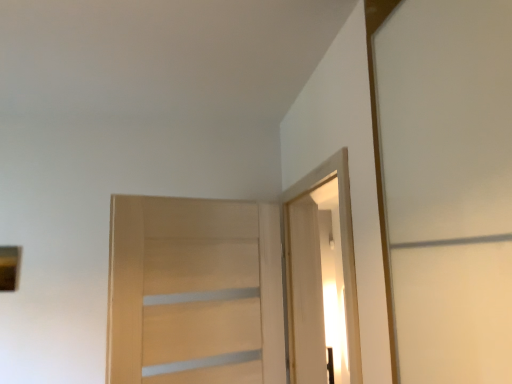
Question: Can light wood door at center, which is the 2th door from right to left, be found inside white glossy elevator at upper right?

Choices:
 (A) yes
 (B) no

Answer: (B)

Question: Is white glossy elevator at upper right not inside light wood door at center, which is counted as the first door, starting from the left?

Choices:
 (A) no
 (B) yes

Answer: (B)

Question: Is white glossy elevator at upper right to the left of light wood door at center, which is counted as the first door, starting from the left, from the viewer's perspective?

Choices:
 (A) yes
 (B) no

Answer: (B)

Question: Can you confirm if white glossy elevator at upper right is smaller than light wood door at center, which is counted as the first door, starting from the left?

Choices:
 (A) yes
 (B) no

Answer: (B)

Question: Are white glossy elevator at upper right and light wood door at center, which is the 2th door from right to left, located far from each other?

Choices:
 (A) yes
 (B) no

Answer: (B)

Question: Is point (212, 319) positioned closer to the camera than point (289, 279)?

Choices:
 (A) farther
 (B) closer

Answer: (B)

Question: Visually, is light wood door at center, which is counted as the first door, starting from the left, positioned to the left or to the right of white glossy elevator at upper right?

Choices:
 (A) left
 (B) right

Answer: (A)

Question: From their relative heights in the image, would you say light wood door at center, which is the 2th door from right to left, is taller or shorter than white glossy elevator at upper right?

Choices:
 (A) short
 (B) tall

Answer: (A)

Question: Would you say light wood door at center, which is the 2th door from right to left, is inside or outside white glossy elevator at upper right?

Choices:
 (A) outside
 (B) inside

Answer: (A)

Question: In terms of height, does white wood door at upper right, which appears as the first door when viewed from the right, look taller or shorter compared to white glossy elevator at upper right?

Choices:
 (A) tall
 (B) short

Answer: (A)

Question: From a real-world perspective, is white wood door at upper right, which is the second door in left-to-right order, positioned above or below white glossy elevator at upper right?

Choices:
 (A) below
 (B) above

Answer: (A)

Question: Choose the correct answer: Is white wood door at upper right, which is the second door in left-to-right order, inside white glossy elevator at upper right or outside it?

Choices:
 (A) inside
 (B) outside

Answer: (B)

Question: Is white wood door at upper right, which is the second door in left-to-right order, in front of or behind white glossy elevator at upper right in the image?

Choices:
 (A) front
 (B) behind

Answer: (B)

Question: Does point [315, 213] appear closer or farther from the camera than point [321, 301]?

Choices:
 (A) farther
 (B) closer

Answer: (A)

Question: From the image's perspective, relative to white wood door at upper right, which appears as the first door when viewed from the right, is white glossy elevator at upper right above or below?

Choices:
 (A) below
 (B) above

Answer: (B)